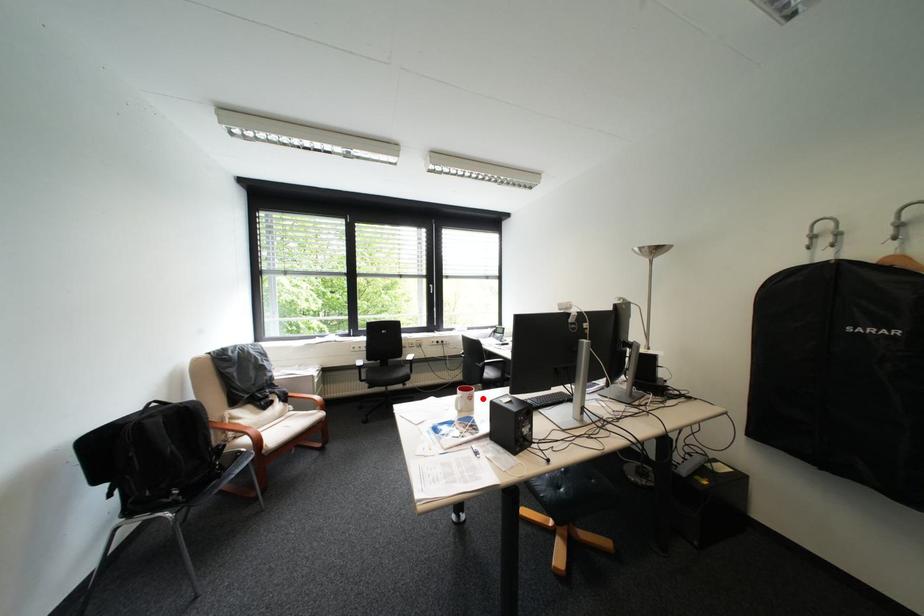
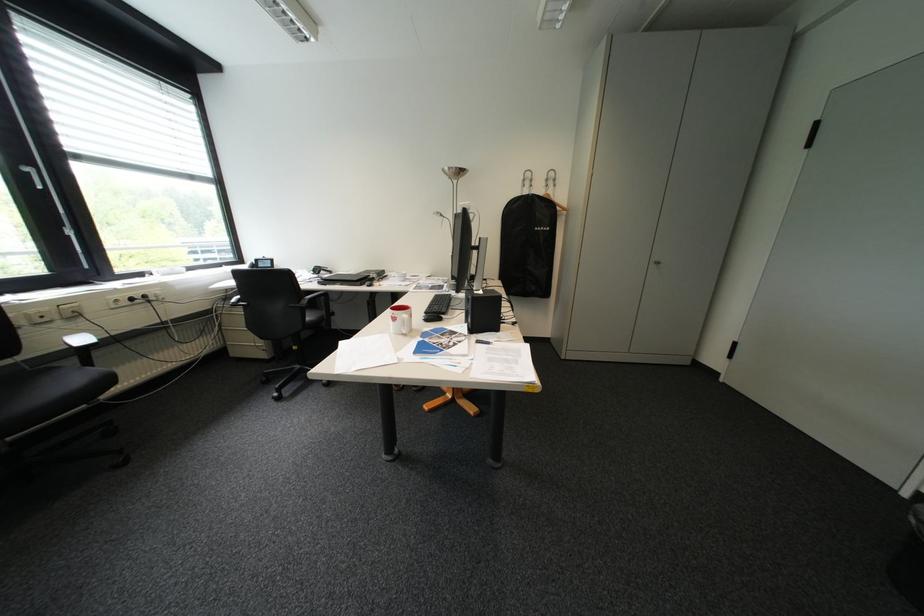
Question: I am providing you with two images of the same scene from different viewpoints. A red point is shown in image1. For the corresponding object point in image2, is it positioned nearer or farther from the camera?

Choices:
 (A) Nearer
 (B) Farther

Answer: (B)